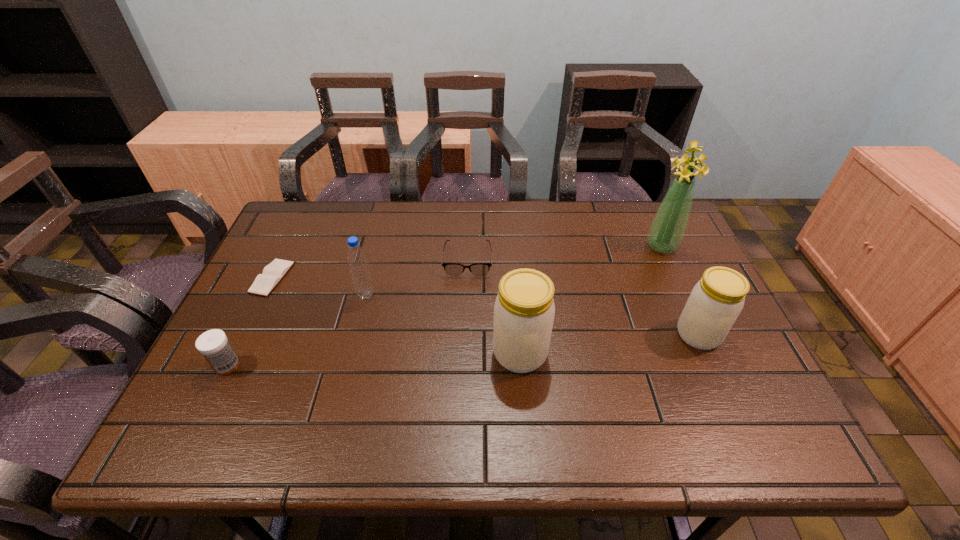
Where is `free space located on the right of the fifth object from right to left`? free space located on the right of the fifth object from right to left is located at coordinates (458, 295).

The width and height of the screenshot is (960, 540). In order to click on vacant space located 0.120m on the front of the diary in this screenshot , I will do `click(246, 333)`.

Identify the location of vacant space situated 0.320m on the right of the medicine. (378, 366).

This screenshot has height=540, width=960. What are the coordinates of `free space located on the face of the spectacles` in the screenshot? It's located at (465, 352).

The width and height of the screenshot is (960, 540). What are the coordinates of `bouquet that is at the far edge` in the screenshot? It's located at point(667,230).

At what (x,y) coordinates should I click in order to perform the action: click on spectacles that is at the far edge. Please return your answer as a coordinate pair (x, y). Looking at the image, I should click on (453, 269).

Locate an element on the screen. This screenshot has width=960, height=540. jar present at the near edge is located at coordinates point(524,310).

The image size is (960, 540). Find the location of `medicine that is positioned at the near edge`. medicine that is positioned at the near edge is located at coordinates (213, 344).

Where is `diary that is positioned at the left edge`? diary that is positioned at the left edge is located at coordinates (273, 273).

At what (x,y) coordinates should I click in order to perform the action: click on medicine present at the left edge. Please return your answer as a coordinate pair (x, y). Looking at the image, I should click on point(213,344).